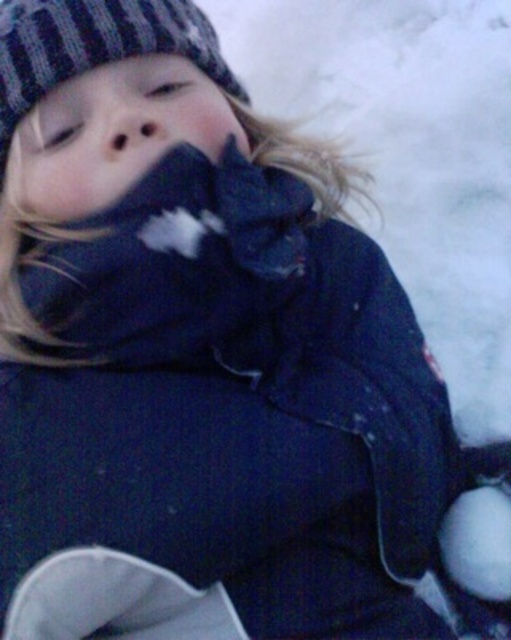
Question: Can you confirm if knitted woolen hat at upper left is positioned above white fluffy snowball at lower right?

Choices:
 (A) yes
 (B) no

Answer: (A)

Question: Which object appears farthest from the camera in this image?

Choices:
 (A) matte black nose at center
 (B) white fluffy snowball at lower right

Answer: (B)

Question: Among these objects, which one is farthest from the camera?

Choices:
 (A) matte black nose at center
 (B) knitted woolen hat at upper left

Answer: (B)

Question: In this image, where is white fluffy snowball at lower right located relative to matte black nose at center?

Choices:
 (A) below
 (B) above

Answer: (A)

Question: Does white fluffy snowball at lower right have a larger size compared to matte black nose at center?

Choices:
 (A) yes
 (B) no

Answer: (A)

Question: Among these objects, which one is farthest from the camera?

Choices:
 (A) knitted woolen hat at upper left
 (B) white fluffy snowball at lower right

Answer: (B)